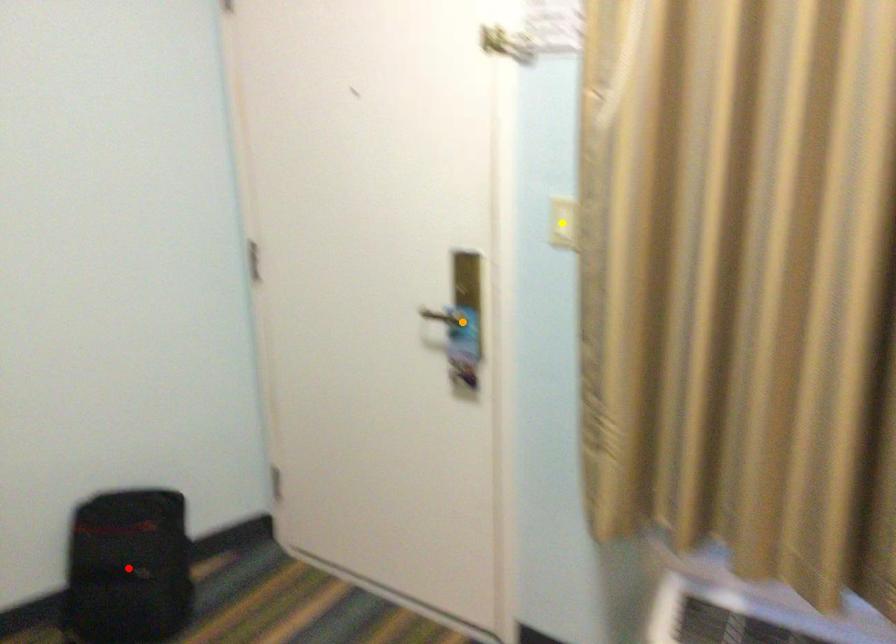
Order these from nearest to farthest:
1. orange point
2. red point
3. yellow point

yellow point → orange point → red point